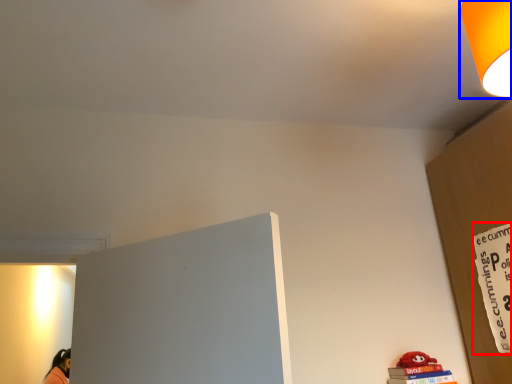
Question: Which of the following is the farthest to the observer, warning sign (highlighted by a red box) or lamp (highlighted by a blue box)?

Choices:
 (A) warning sign
 (B) lamp

Answer: (A)